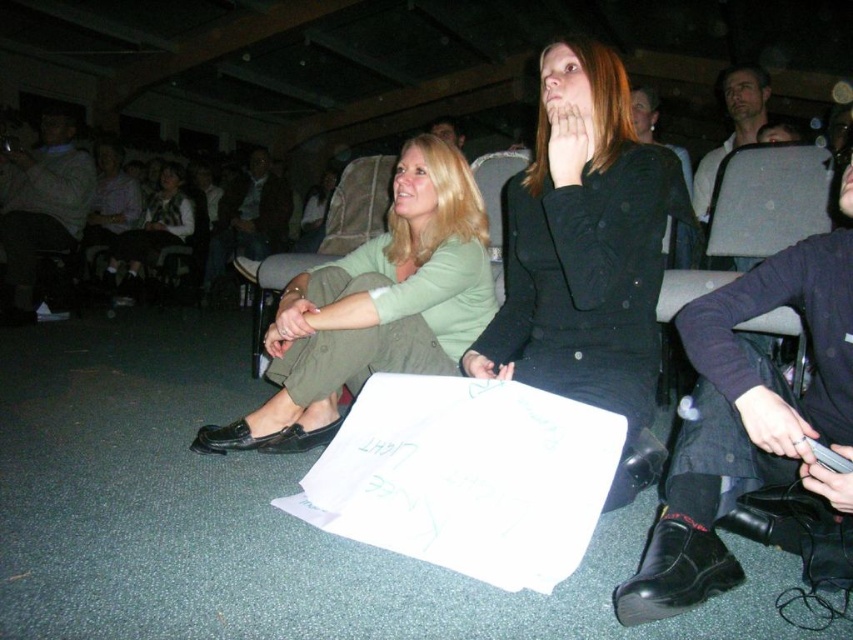
Does light brown leather jacket at upper left have a lesser width compared to dark brown leather jacket at center?

Incorrect, light brown leather jacket at upper left's width is not less than dark brown leather jacket at center's.

The image size is (853, 640). In order to click on light brown leather jacket at upper left in this screenshot , I will do `click(39, 205)`.

The height and width of the screenshot is (640, 853). I want to click on light brown leather jacket at upper left, so click(x=39, y=205).

Is black matte jacket at center to the right of black leather jacket at upper center from the viewer's perspective?

In fact, black matte jacket at center is to the left of black leather jacket at upper center.

Which of these two, black matte jacket at center or black leather jacket at upper center, stands taller?

black matte jacket at center is taller.

Where is `black matte jacket at center`? black matte jacket at center is located at coordinates (584, 244).

Does light purple shirt at upper left have a smaller size compared to black leather jacket at upper center?

Yes.

Does point (85, 246) come behind point (674, 148)?

That is True.

In order to click on light purple shirt at upper left in this screenshot , I will do `click(109, 196)`.